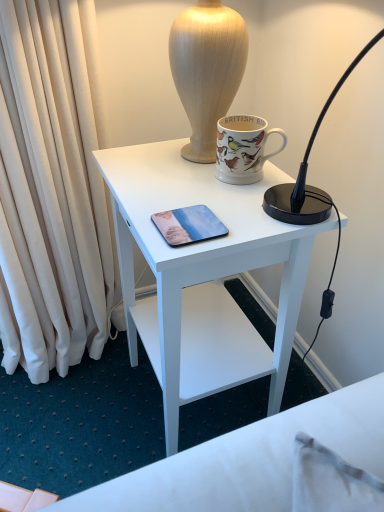
Locate an element on the screen. matte ceramic mug at upper center is located at coordinates pyautogui.click(x=243, y=148).

Does point (230, 126) appear closer or farther from the camera than point (205, 231)?

Point (230, 126) appears to be farther away from the viewer than point (205, 231).

Measure the distance between matte ceramic mug at upper center and metallic glossy phone at center.

matte ceramic mug at upper center is 7.04 inches from metallic glossy phone at center.

Considering the sizes of objects matte ceramic mug at upper center and metallic glossy phone at center in the image provided, who is thinner, matte ceramic mug at upper center or metallic glossy phone at center?

Thinner between the two is matte ceramic mug at upper center.

Can you confirm if matte ceramic mug at upper center is bigger than metallic glossy phone at center?

Yes.

Is white matte desk at center far away from matte ceramic mug at upper center?

No, white matte desk at center is not far from matte ceramic mug at upper center.

From a real-world perspective, relative to matte ceramic mug at upper center, is white matte desk at center vertically above or below?

white matte desk at center is situated lower than matte ceramic mug at upper center in the real world.

From the picture: Is the depth of white matte desk at center less than that of matte ceramic mug at upper center?

Yes.

Which of these two, white matte desk at center or matte ceramic mug at upper center, is bigger?

white matte desk at center.

Is white matte desk at center shorter than metallic glossy phone at center?

In fact, white matte desk at center may be taller than metallic glossy phone at center.

Measure the distance from white matte desk at center to metallic glossy phone at center.

white matte desk at center is 11.13 inches away from metallic glossy phone at center.

I want to click on desk on the right of metallic glossy phone at center, so click(202, 276).

In the scene shown: Can you confirm if white matte desk at center is positioned to the right of metallic glossy phone at center?

Indeed, white matte desk at center is positioned on the right side of metallic glossy phone at center.

From a real-world perspective, is matte ceramic mug at upper center beneath white matte desk at center?

Actually, matte ceramic mug at upper center is physically above white matte desk at center in the real world.

Between matte ceramic mug at upper center and white matte desk at center, which one is positioned behind?

matte ceramic mug at upper center is further from the camera.

Is point (285, 144) closer or farther from the camera than point (191, 313)?

Point (285, 144).

The image size is (384, 512). In order to click on desk on the left of matte ceramic mug at upper center in this screenshot , I will do `click(202, 276)`.

From the image's perspective, between metallic glossy phone at center and matte ceramic mug at upper center, which one is located above?

matte ceramic mug at upper center is shown above in the image.

Is metallic glossy phone at center facing away from matte ceramic mug at upper center?

No, metallic glossy phone at center's orientation is not away from matte ceramic mug at upper center.

The height and width of the screenshot is (512, 384). In the image, there is a metallic glossy phone at center. What are the coordinates of `coffee cup above it (from the image's perspective)` in the screenshot? It's located at (243, 148).

Between metallic glossy phone at center and white matte desk at center, which one has less height?

metallic glossy phone at center.

Is metallic glossy phone at center far away from white matte desk at center?

No, metallic glossy phone at center is not far away from white matte desk at center.

Is metallic glossy phone at center surrounding white matte desk at center?

No, metallic glossy phone at center does not contain white matte desk at center.

Considering the sizes of metallic glossy phone at center and white matte desk at center in the image, is metallic glossy phone at center wider or thinner than white matte desk at center?

Considering their sizes, metallic glossy phone at center looks slimmer than white matte desk at center.

What are the coordinates of `coffee cup above the metallic glossy phone at center (from the image's perspective)` in the screenshot? It's located at (243, 148).

Locate an element on the screen. desk on the left of matte ceramic mug at upper center is located at coordinates (202, 276).

Looking at the image, which one is located further to matte ceramic mug at upper center, metallic glossy phone at center or white matte desk at center?

white matte desk at center lies further to matte ceramic mug at upper center than the other object.

From the image, which object appears to be farther from metallic glossy phone at center, matte ceramic mug at upper center or white matte desk at center?

white matte desk at center.

Considering their positions, is white matte desk at center positioned closer to metallic glossy phone at center than matte ceramic mug at upper center?

matte ceramic mug at upper center lies closer to metallic glossy phone at center than the other object.

When comparing their distances from matte ceramic mug at upper center, does white matte desk at center or metallic glossy phone at center seem further?

white matte desk at center is positioned further to the anchor matte ceramic mug at upper center.

When comparing their distances from white matte desk at center, does metallic glossy phone at center or matte ceramic mug at upper center seem further?

metallic glossy phone at center.

Based on their spatial positions, is matte ceramic mug at upper center or metallic glossy phone at center closer to white matte desk at center?

matte ceramic mug at upper center lies closer to white matte desk at center than the other object.

Where is `mobile phone that lies between matte ceramic mug at upper center and white matte desk at center from top to bottom`? Image resolution: width=384 pixels, height=512 pixels. mobile phone that lies between matte ceramic mug at upper center and white matte desk at center from top to bottom is located at coordinates (188, 225).